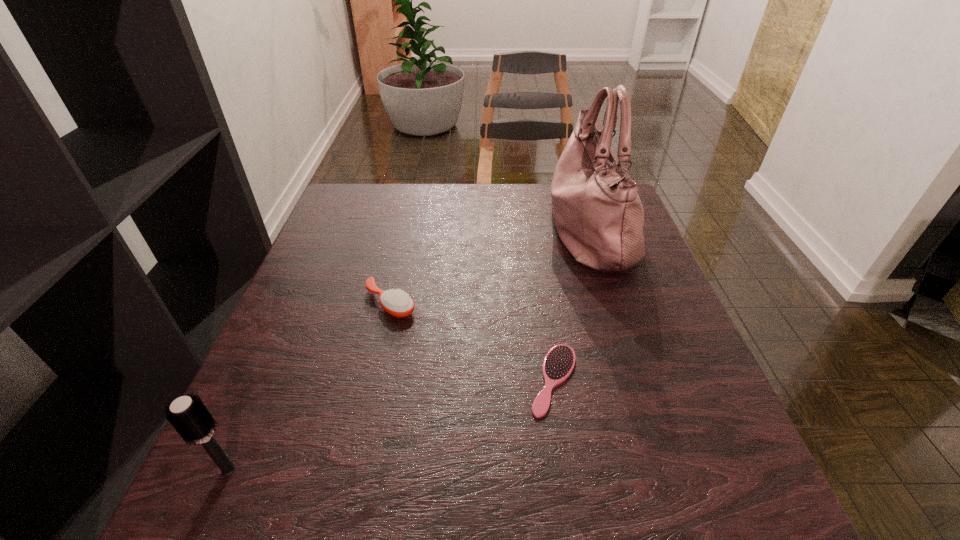
This screenshot has width=960, height=540. In order to click on free location located at the front of the tallest object with handles in this screenshot , I will do `click(516, 231)`.

This screenshot has height=540, width=960. What are the coordinates of `vacant space positioned 0.080m on the right of the third shortest object` in the screenshot? It's located at (295, 470).

At what (x,y) coordinates should I click in order to perform the action: click on free space located 0.170m on the front of the second farthest object. Please return your answer as a coordinate pair (x, y). Image resolution: width=960 pixels, height=540 pixels. Looking at the image, I should click on (372, 392).

At what (x,y) coordinates should I click in order to perform the action: click on vacant area situated on the left of the shortest hairbrush. Please return your answer as a coordinate pair (x, y). The image size is (960, 540). Looking at the image, I should click on (474, 380).

This screenshot has height=540, width=960. I want to click on object that is at the far edge, so click(x=599, y=217).

Identify the location of object present at the near edge. coord(188,415).

Where is `object present at the left edge`? Image resolution: width=960 pixels, height=540 pixels. object present at the left edge is located at coordinates (188, 415).

The image size is (960, 540). I want to click on object present at the right edge, so click(x=599, y=217).

I want to click on object present at the near left corner, so 188,415.

Image resolution: width=960 pixels, height=540 pixels. In order to click on object situated at the far right corner in this screenshot , I will do `click(599, 217)`.